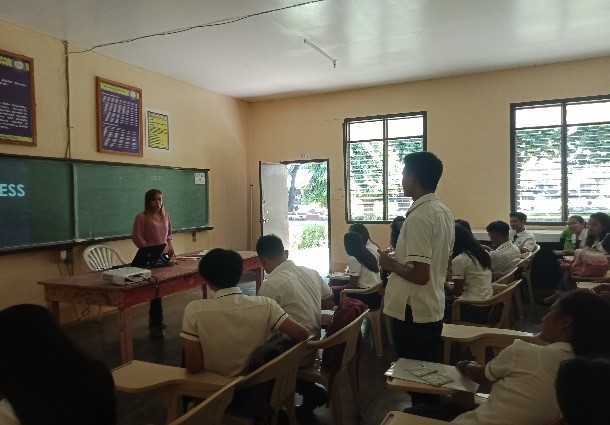
Find the location of `chair`. chair is located at coordinates 292,374.